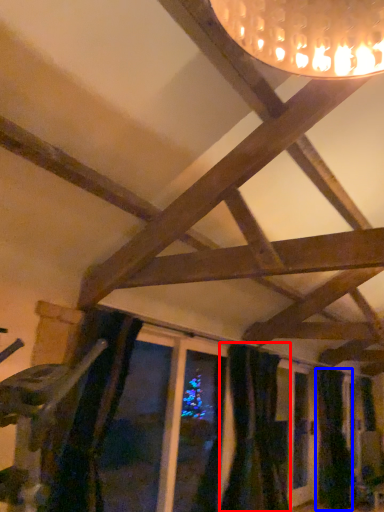
Question: Which object is further to the camera taking this photo, curtain (highlighted by a red box) or curtain (highlighted by a blue box)?

Choices:
 (A) curtain
 (B) curtain

Answer: (B)